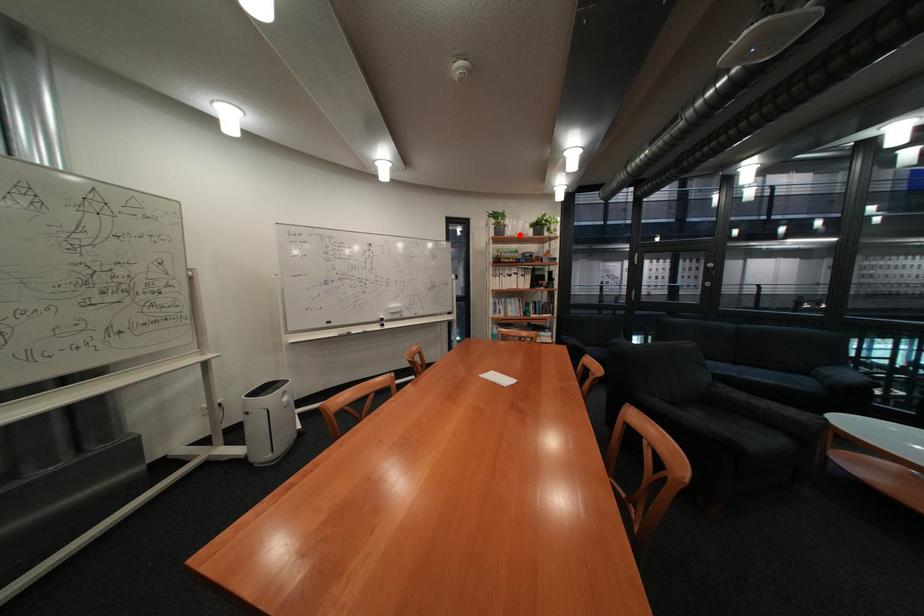
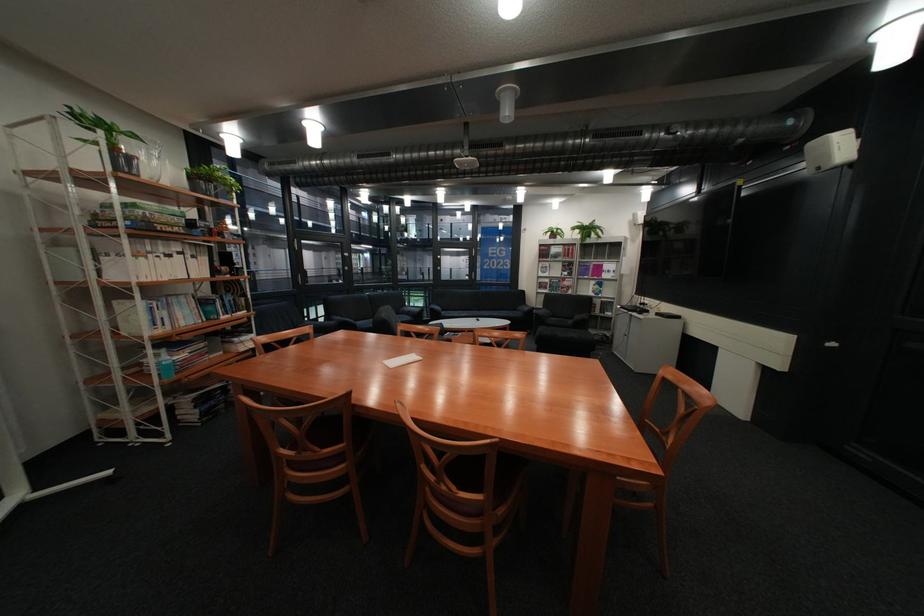
Question: I am providing you with two images of the same scene from different viewpoints. In image1, a red point is highlighted. Considering the same 3D point in image2, which of the following is correct?

Choices:
 (A) It is closer
 (B) It is farther

Answer: (B)